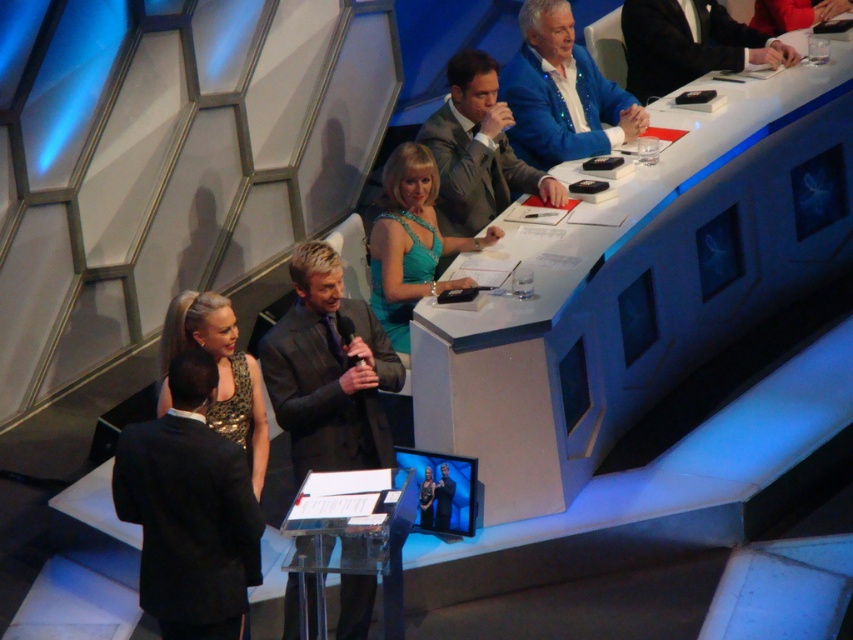
Which is more to the right, white plastic table at center or matte gray suit at center?

white plastic table at center is more to the right.

What are the coordinates of `white plastic table at center` in the screenshot? It's located at (639, 288).

This screenshot has width=853, height=640. What are the coordinates of `white plastic table at center` in the screenshot? It's located at (639, 288).

Does black satin suit at lower left appear on the right side of blue velvet jacket at upper center?

Incorrect, black satin suit at lower left is not on the right side of blue velvet jacket at upper center.

Image resolution: width=853 pixels, height=640 pixels. Identify the location of black satin suit at lower left. (190, 509).

Identify the location of black satin suit at lower left. The height and width of the screenshot is (640, 853). (190, 509).

Does blue velvet jacket at upper center appear on the right side of gold sequined dress at lower left?

Yes, blue velvet jacket at upper center is to the right of gold sequined dress at lower left.

Is blue velvet jacket at upper center to the left of gold sequined dress at lower left from the viewer's perspective?

Incorrect, blue velvet jacket at upper center is not on the left side of gold sequined dress at lower left.

I want to click on blue velvet jacket at upper center, so click(x=561, y=92).

This screenshot has width=853, height=640. I want to click on blue velvet jacket at upper center, so click(561, 92).